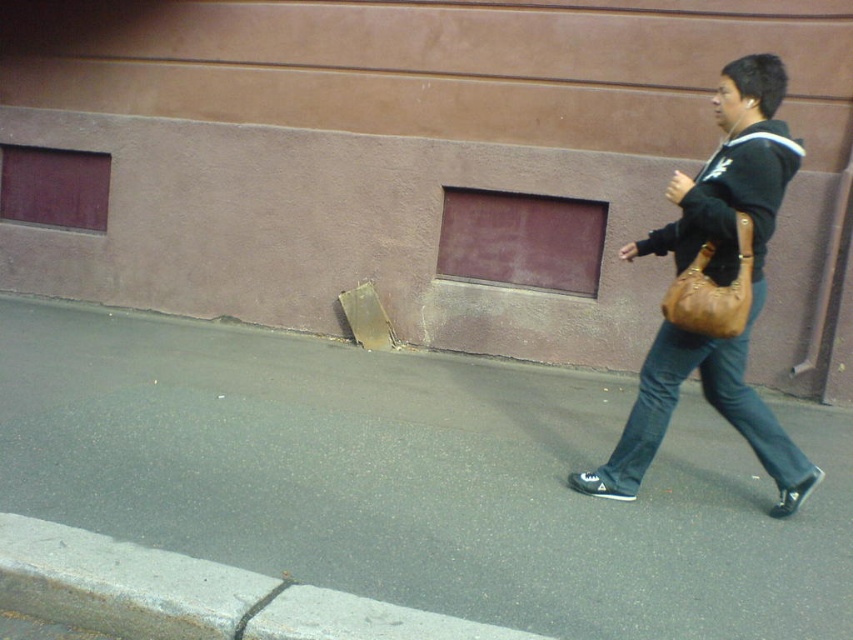
In the scene shown: You are a delivery person trying to place a large package on the gray concrete curb at lower left. The package is the same size as the leather tan shoulder bag at right. Will the package fit on the curb?

The gray concrete curb at lower left is bigger than the leather tan shoulder bag at right, so the package, which is the same size as the bag, will fit on the curb.

You are a delivery person needing to place a 1.5 meter long package on the ground. The gray asphalt at lower center and gray concrete curb at lower left are available. Which surface can accommodate the package without it hanging over the edge?

The gray asphalt at lower center can accommodate the package without it hanging over the edge because its width is greater than the gray concrete curb at lower left.

You are a delivery person trying to place a package on the gray concrete curb at lower left. However, there is a leather tan shoulder bag at right in the way. Can you move the bag to access the curb?

The gray concrete curb at lower left is below the leather tan shoulder bag at right, so moving the leather tan shoulder bag at right would allow access to the curb.